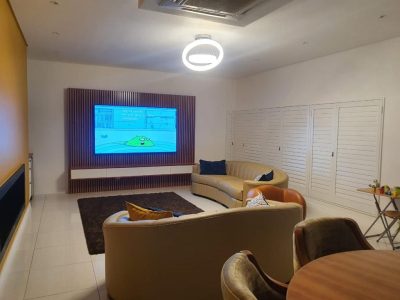
The width and height of the screenshot is (400, 300). What are the coordinates of `tv` in the screenshot? It's located at (142, 124).